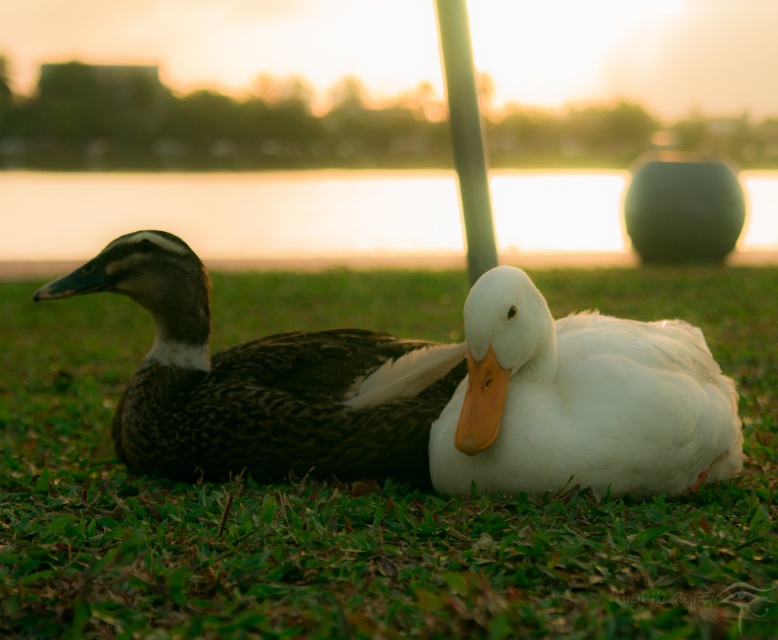
Question: Does white matte duck at center appear under dark brown feathers at center?

Choices:
 (A) no
 (B) yes

Answer: (B)

Question: Which point is closer to the camera?

Choices:
 (A) white glossy pole at center
 (B) dark brown feathers at center
 (C) green grass at center

Answer: (C)

Question: Which of the following is the farthest from the observer?

Choices:
 (A) (268, 340)
 (B) (703, 531)
 (C) (573, 323)
 (D) (471, 173)

Answer: (D)

Question: Can you confirm if green grass at center is wider than white glossy pole at center?

Choices:
 (A) yes
 (B) no

Answer: (A)

Question: Among these points, which one is farthest from the camera?

Choices:
 (A) (34, 300)
 (B) (479, 225)

Answer: (B)

Question: Can you confirm if dark brown feathers at center is thinner than white glossy pole at center?

Choices:
 (A) no
 (B) yes

Answer: (A)